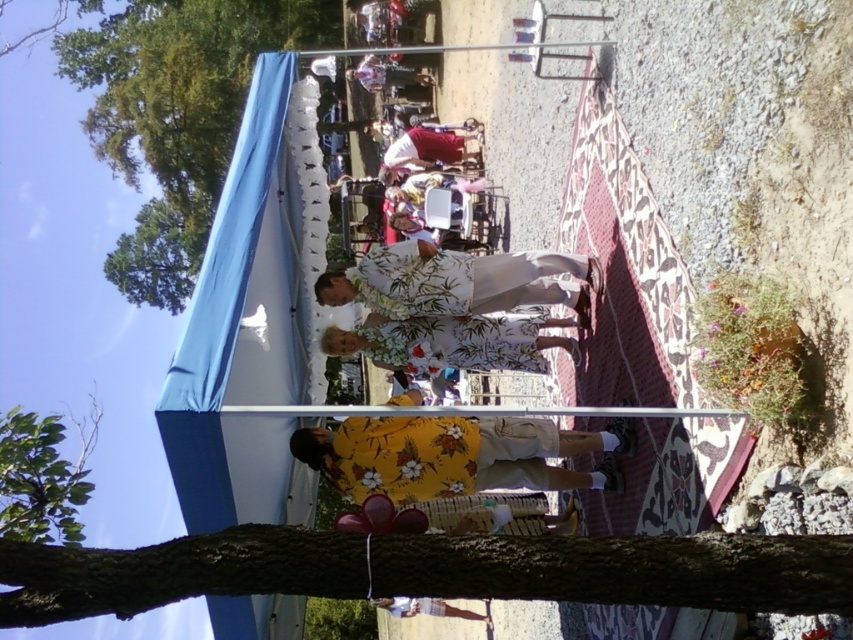
You are attending an outdoor event and notice the brown rough bark at lower center and the yellow floral fabric at center. Which object is positioned higher in the image?

The brown rough bark at lower center is above the yellow floral fabric at center, so it is positioned higher in the image.

From the picture: You are a photographer at the event and want to capture both the green leafy tree at lower left and the matte red robe at center in a single frame. Which object should you focus on first to ensure both are in the frame?

The green leafy tree at lower left is bigger than the matte red robe at center, so you should focus on the matte red robe at center first to ensure both fit within the frame.

You are attending an outdoor event and want to take a photo of the matte red robe at center without the green leafy tree at lower left blocking the view. Where should you move to achieve this?

Move behind the green leafy tree at lower left so that it is no longer in front of the matte red robe at center, allowing you to capture the robe clearly.